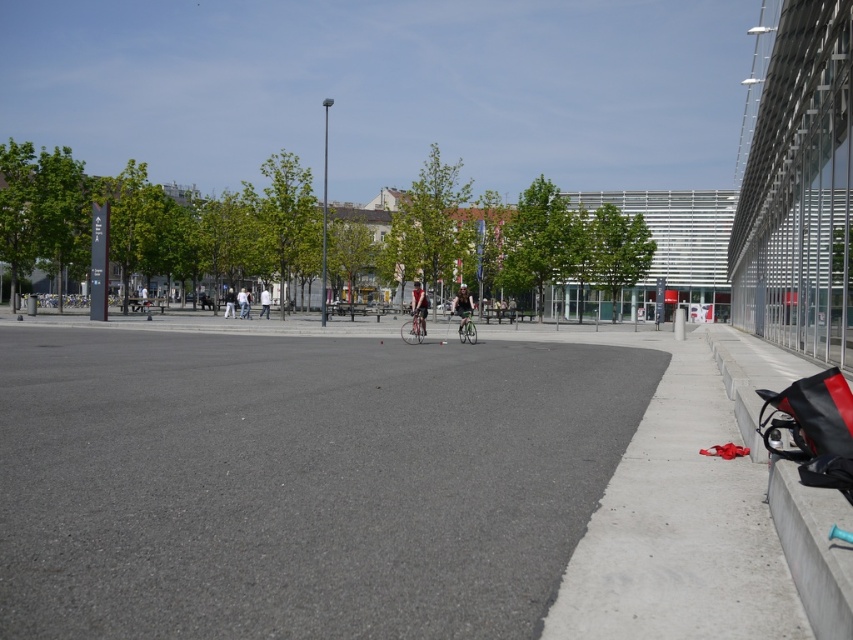
Who is taller, green matte bicycle at center or light blue jeans at center?

With more height is light blue jeans at center.

Does green matte bicycle at center have a lesser height compared to light blue jeans at center?

Indeed, green matte bicycle at center has a lesser height compared to light blue jeans at center.

I want to click on green matte bicycle at center, so (466, 326).

Identify the location of green matte bicycle at center. This screenshot has width=853, height=640. (466, 326).

Between point (784, 374) and point (265, 308), which one is positioned in front?

Point (784, 374) is more forward.

Is the position of concrete ledge at right less distant than that of white fabric jacket at center?

Yes, it is in front of white fabric jacket at center.

This screenshot has height=640, width=853. I want to click on concrete ledge at right, so pyautogui.click(x=790, y=484).

Which is above, gray asphalt pavement at center or white fabric bag at center?

Positioned higher is white fabric bag at center.

Which of these two, gray asphalt pavement at center or white fabric bag at center, stands shorter?

With less height is gray asphalt pavement at center.

Describe the element at coordinates (299, 481) in the screenshot. I see `gray asphalt pavement at center` at that location.

Identify the location of gray asphalt pavement at center. This screenshot has width=853, height=640. (299, 481).